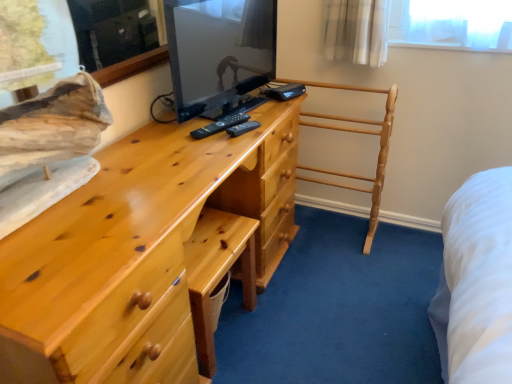
Question: Is the surface of light brown wooden towel rack at center in direct contact with black plastic remote at center?

Choices:
 (A) no
 (B) yes

Answer: (A)

Question: Can we say light brown wooden towel rack at center lies outside black plastic remote at center?

Choices:
 (A) no
 (B) yes

Answer: (B)

Question: Is light brown wooden towel rack at center wider than black plastic remote at center?

Choices:
 (A) yes
 (B) no

Answer: (A)

Question: From the image's perspective, is light brown wooden towel rack at center under black plastic remote at center?

Choices:
 (A) yes
 (B) no

Answer: (A)

Question: From a real-world perspective, is light brown wooden towel rack at center located beneath black plastic remote at center?

Choices:
 (A) no
 (B) yes

Answer: (B)

Question: Is matte black tv at center in front of or behind matte pine chest of drawers at center in the image?

Choices:
 (A) front
 (B) behind

Answer: (B)

Question: Is point (221, 84) closer or farther from the camera than point (276, 243)?

Choices:
 (A) farther
 (B) closer

Answer: (B)

Question: Based on their positions, is matte black tv at center located to the left or right of matte pine chest of drawers at center?

Choices:
 (A) right
 (B) left

Answer: (A)

Question: From their relative heights in the image, would you say matte black tv at center is taller or shorter than matte pine chest of drawers at center?

Choices:
 (A) tall
 (B) short

Answer: (B)

Question: Considering the positions of point (225, 9) and point (379, 147), is point (225, 9) closer or farther from the camera than point (379, 147)?

Choices:
 (A) closer
 (B) farther

Answer: (A)

Question: Looking at the image, does matte black tv at center seem bigger or smaller compared to light brown wooden towel rack at center?

Choices:
 (A) small
 (B) big

Answer: (A)

Question: From the image's perspective, is matte black tv at center positioned above or below light brown wooden towel rack at center?

Choices:
 (A) above
 (B) below

Answer: (A)

Question: Considering the relative positions of matte black tv at center and light brown wooden towel rack at center in the image provided, is matte black tv at center to the left or to the right of light brown wooden towel rack at center?

Choices:
 (A) left
 (B) right

Answer: (A)

Question: Is point (117, 360) positioned closer to the camera than point (234, 48)?

Choices:
 (A) farther
 (B) closer

Answer: (B)

Question: From the image's perspective, is matte pine chest of drawers at center located above or below matte black tv at center?

Choices:
 (A) below
 (B) above

Answer: (A)